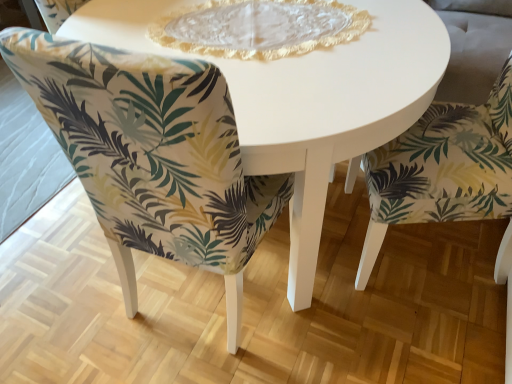
Question: Can you confirm if green leaf-patterned fabric chair at lower right, which ranks as the first chair in right-to-left order, is bigger than white glossy table at center?

Choices:
 (A) yes
 (B) no

Answer: (B)

Question: From the image's perspective, is green leaf-patterned fabric chair at lower right, the second chair positioned from the left, below white glossy table at center?

Choices:
 (A) yes
 (B) no

Answer: (A)

Question: Is the position of green leaf-patterned fabric chair at lower right, the second chair positioned from the left, less distant than that of white glossy table at center?

Choices:
 (A) no
 (B) yes

Answer: (B)

Question: Is green leaf-patterned fabric chair at lower right, the second chair positioned from the left, beside white glossy table at center?

Choices:
 (A) yes
 (B) no

Answer: (B)

Question: Would you say green leaf-patterned fabric chair at lower right, which ranks as the first chair in right-to-left order, is outside white glossy table at center?

Choices:
 (A) no
 (B) yes

Answer: (B)

Question: Can you confirm if green leaf-patterned fabric chair at lower right, the second chair positioned from the left, is smaller than white glossy table at center?

Choices:
 (A) yes
 (B) no

Answer: (A)

Question: Is green leaf-patterned fabric chair at lower right, the second chair positioned from the left, at the right side of green leaf-patterned fabric chair at center, which is counted as the second chair, starting from the right?

Choices:
 (A) no
 (B) yes

Answer: (B)

Question: Would you consider green leaf-patterned fabric chair at lower right, which ranks as the first chair in right-to-left order, to be distant from green leaf-patterned fabric chair at center, marked as the 1th chair in a left-to-right arrangement?

Choices:
 (A) yes
 (B) no

Answer: (B)

Question: From the image's perspective, is green leaf-patterned fabric chair at lower right, the second chair positioned from the left, beneath green leaf-patterned fabric chair at center, marked as the 1th chair in a left-to-right arrangement?

Choices:
 (A) no
 (B) yes

Answer: (A)

Question: Is green leaf-patterned fabric chair at lower right, the second chair positioned from the left, bigger than green leaf-patterned fabric chair at center, marked as the 1th chair in a left-to-right arrangement?

Choices:
 (A) yes
 (B) no

Answer: (B)

Question: Is green leaf-patterned fabric chair at lower right, which ranks as the first chair in right-to-left order, aimed at green leaf-patterned fabric chair at center, marked as the 1th chair in a left-to-right arrangement?

Choices:
 (A) no
 (B) yes

Answer: (B)

Question: Is the position of green leaf-patterned fabric chair at lower right, which ranks as the first chair in right-to-left order, less distant than that of green leaf-patterned fabric chair at center, which is counted as the second chair, starting from the right?

Choices:
 (A) yes
 (B) no

Answer: (B)

Question: Can you confirm if green leaf-patterned fabric chair at center, which is counted as the second chair, starting from the right, is shorter than green leaf-patterned fabric chair at lower right, which ranks as the first chair in right-to-left order?

Choices:
 (A) yes
 (B) no

Answer: (A)